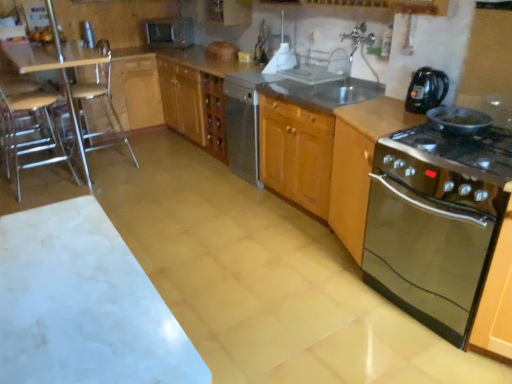
This screenshot has width=512, height=384. Find the location of `vacant space to the right of clear plastic bar stool at left, positioned as the 2th bar stool in left-to-right order`. vacant space to the right of clear plastic bar stool at left, positioned as the 2th bar stool in left-to-right order is located at coordinates (151, 165).